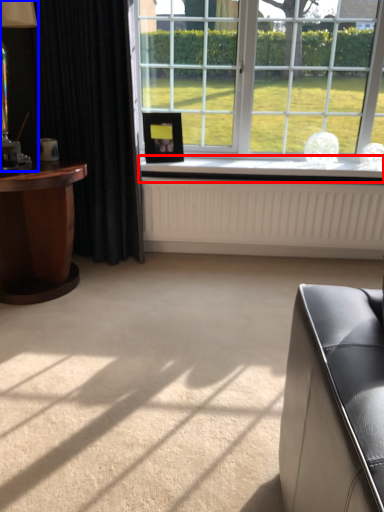
Question: Which object appears closest to the camera in this image, window sill (highlighted by a red box) or table lamp (highlighted by a blue box)?

Choices:
 (A) window sill
 (B) table lamp

Answer: (B)